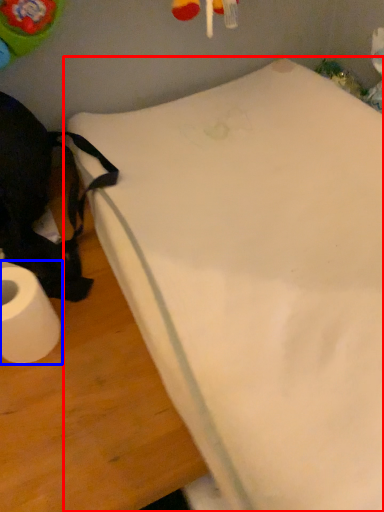
Question: Which object appears farthest to the camera in this image, furniture (highlighted by a red box) or toilet paper (highlighted by a blue box)?

Choices:
 (A) furniture
 (B) toilet paper

Answer: (B)